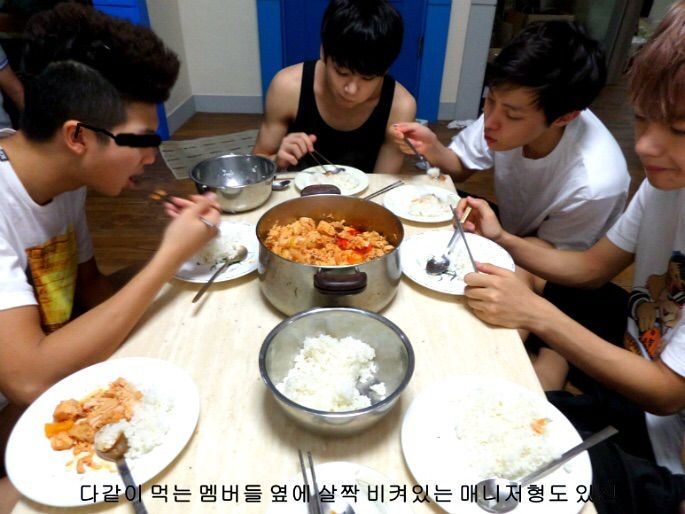
Where is `white dinner plates`? white dinner plates is located at coordinates (177, 399), (423, 453), (340, 471), (435, 285), (399, 209), (355, 186), (242, 271).